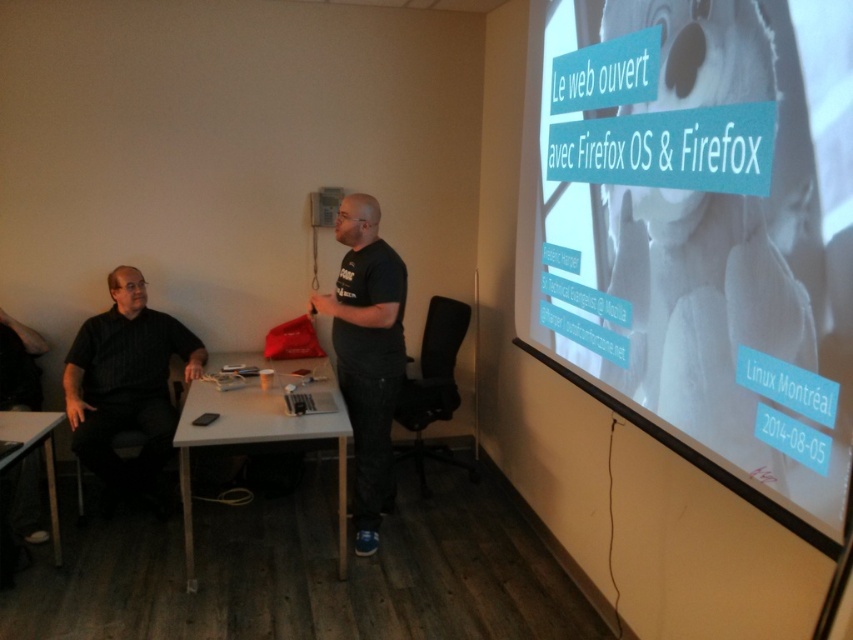
Question: Estimate the real-world distances between objects in this image. Which object is closer to the black matte shirt at center?

Choices:
 (A) white matte projection screen at upper right
 (B) white plastic table at center

Answer: (B)

Question: Is white matte projection screen at upper right to the right of white plastic table at center from the viewer's perspective?

Choices:
 (A) no
 (B) yes

Answer: (B)

Question: Among these objects, which one is nearest to the camera?

Choices:
 (A) white plastic table at center
 (B) black matte shirt at left
 (C) black matte shirt at center
 (D) white matte projection screen at upper right

Answer: (D)

Question: Is black matte shirt at left behind black matte shirt at center?

Choices:
 (A) no
 (B) yes

Answer: (B)

Question: Does black matte shirt at center appear on the left side of matte white table at lower left?

Choices:
 (A) yes
 (B) no

Answer: (B)

Question: Which of the following is the closest to the observer?

Choices:
 (A) (376, 496)
 (B) (54, 522)
 (C) (99, 342)
 (D) (647, 205)

Answer: (D)